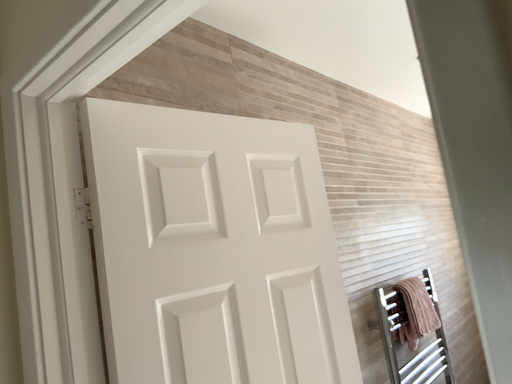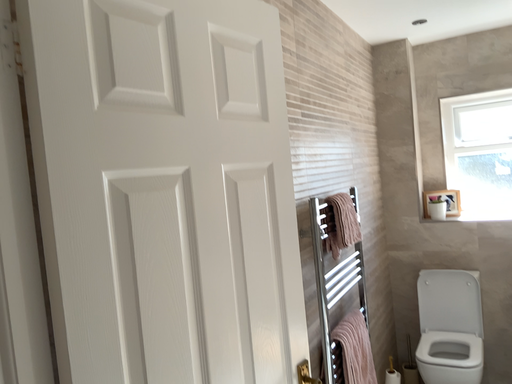
Question: Which way did the camera rotate in the video?

Choices:
 (A) rotated downward
 (B) rotated upward

Answer: (A)